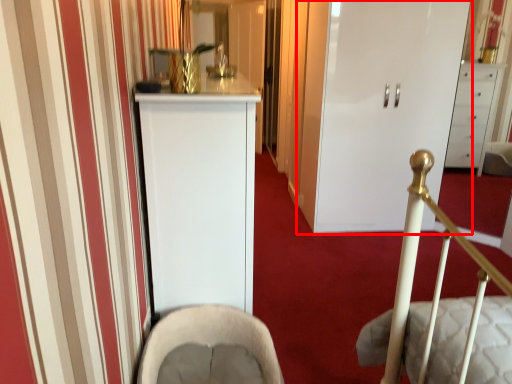
Question: In this image, where is door (annotated by the red box) located relative to rocking chair?

Choices:
 (A) left
 (B) right

Answer: (B)